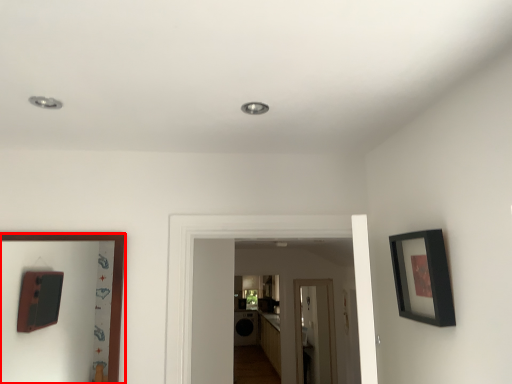
Question: In this image, where is picture frame (annotated by the red box) located relative to picture frame?

Choices:
 (A) right
 (B) left

Answer: (B)